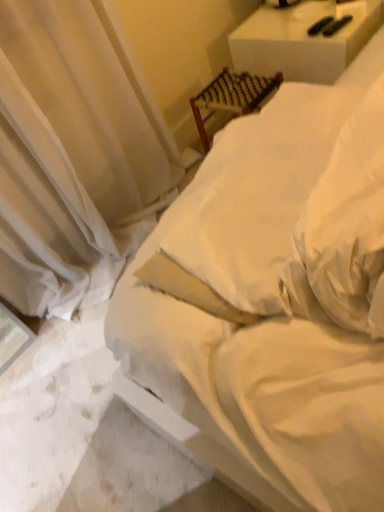
Measure the distance between point (268, 84) and camera.

The depth of point (268, 84) is 6.30 feet.

The width and height of the screenshot is (384, 512). What do you see at coordinates (303, 40) in the screenshot?
I see `white woven chair at upper right, the 2th furniture from the left` at bounding box center [303, 40].

The height and width of the screenshot is (512, 384). Find the location of `white sheer curtain at upper left`. white sheer curtain at upper left is located at coordinates (70, 158).

Is point (293, 17) positioned before point (51, 95)?

No.

From the image's perspective, is white woven chair at upper right, the 2th furniture from the left, above or below white sheer curtain at upper left?

white woven chair at upper right, the 2th furniture from the left, is above white sheer curtain at upper left.

Is white woven chair at upper right, the 2th furniture from the left, to the right of white sheer curtain at upper left from the viewer's perspective?

Yes.

Is white woven chair at upper right, the 2th furniture from the left, looking in the opposite direction of white sheer curtain at upper left?

white woven chair at upper right, the 2th furniture from the left, does not have its back to white sheer curtain at upper left.

Does white soft bed at center have a lesser height compared to white sheer curtain at upper left?

Yes.

Can white sheer curtain at upper left be found inside white soft bed at center?

No, white sheer curtain at upper left is not surrounded by white soft bed at center.

Can you tell me how much white soft bed at center and white sheer curtain at upper left differ in facing direction?

The angle between the facing direction of white soft bed at center and the facing direction of white sheer curtain at upper left is 89.5 degrees.

Is white soft bed at center looking in the opposite direction of white sheer curtain at upper left?

That's not correct — white soft bed at center is not looking away from white sheer curtain at upper left.

Does white soft bed at center have a smaller size compared to woven wood chair at upper center, which ranks as the first furniture in left-to-right order?

Incorrect, white soft bed at center is not smaller in size than woven wood chair at upper center, which ranks as the first furniture in left-to-right order.

This screenshot has width=384, height=512. There is a white soft bed at center. What are the coordinates of `the 2nd furniture below it (from a real-world perspective)` in the screenshot? It's located at (231, 97).

Can you tell me how much white soft bed at center and woven wood chair at upper center, marked as the second furniture in a right-to-left arrangement, differ in facing direction?

1.64 degrees separate the facing orientations of white soft bed at center and woven wood chair at upper center, marked as the second furniture in a right-to-left arrangement.

Is white soft bed at center far from woven wood chair at upper center, which ranks as the first furniture in left-to-right order?

No, there isn't a large distance between white soft bed at center and woven wood chair at upper center, which ranks as the first furniture in left-to-right order.

Which object is positioned more to the right, woven wood chair at upper center, marked as the second furniture in a right-to-left arrangement, or white sheer curtain at upper left?

From the viewer's perspective, woven wood chair at upper center, marked as the second furniture in a right-to-left arrangement, appears more on the right side.

Considering the sizes of woven wood chair at upper center, marked as the second furniture in a right-to-left arrangement, and white sheer curtain at upper left in the image, is woven wood chair at upper center, marked as the second furniture in a right-to-left arrangement, bigger or smaller than white sheer curtain at upper left?

In the image, woven wood chair at upper center, marked as the second furniture in a right-to-left arrangement, appears to be smaller than white sheer curtain at upper left.

You are a GUI agent. You are given a task and a screenshot of the screen. Output one action in this format:
    pyautogui.click(x=<x>, y=<y>)
    Task: Click on the curtain on the left of woven wood chair at upper center, marked as the second furniture in a right-to-left arrangement
    
    Given the screenshot: What is the action you would take?
    pyautogui.click(x=70, y=158)

From the image's perspective, is woven wood chair at upper center, marked as the second furniture in a right-to-left arrangement, above or below white sheer curtain at upper left?

woven wood chair at upper center, marked as the second furniture in a right-to-left arrangement, is above white sheer curtain at upper left.

Is woven wood chair at upper center, marked as the second furniture in a right-to-left arrangement, surrounding white soft bed at center?

Actually, white soft bed at center is outside woven wood chair at upper center, marked as the second furniture in a right-to-left arrangement.

Could you tell me if woven wood chair at upper center, marked as the second furniture in a right-to-left arrangement, is turned towards white soft bed at center?

No, woven wood chair at upper center, marked as the second furniture in a right-to-left arrangement, is not facing towards white soft bed at center.

Is woven wood chair at upper center, which ranks as the first furniture in left-to-right order, taller or shorter than white soft bed at center?

woven wood chair at upper center, which ranks as the first furniture in left-to-right order, is shorter than white soft bed at center.

Which object is thinner, woven wood chair at upper center, marked as the second furniture in a right-to-left arrangement, or white soft bed at center?

woven wood chair at upper center, marked as the second furniture in a right-to-left arrangement.

Would you say white sheer curtain at upper left is inside or outside white woven chair at upper right, the 2th furniture from the left?

white sheer curtain at upper left exists outside the volume of white woven chair at upper right, the 2th furniture from the left.

From a real-world perspective, is white sheer curtain at upper left above or below white woven chair at upper right, the first furniture when ordered from right to left?

Clearly, from a real-world perspective, white sheer curtain at upper left is above white woven chair at upper right, the first furniture when ordered from right to left.

Looking at this image, between white sheer curtain at upper left and white woven chair at upper right, the 2th furniture from the left, which one has smaller width?

Thinner between the two is white sheer curtain at upper left.

Considering the relative positions of white sheer curtain at upper left and white woven chair at upper right, the 2th furniture from the left, in the image provided, is white sheer curtain at upper left behind white woven chair at upper right, the 2th furniture from the left,?

No, it is not.

Which of these two, white woven chair at upper right, the 2th furniture from the left, or woven wood chair at upper center, which ranks as the first furniture in left-to-right order, is wider?

Wider between the two is white woven chair at upper right, the 2th furniture from the left.

Considering the positions of objects white woven chair at upper right, the first furniture when ordered from right to left, and woven wood chair at upper center, marked as the second furniture in a right-to-left arrangement, in the image provided, who is in front, white woven chair at upper right, the first furniture when ordered from right to left, or woven wood chair at upper center, marked as the second furniture in a right-to-left arrangement,?

white woven chair at upper right, the first furniture when ordered from right to left, is closer to the camera.

Is white woven chair at upper right, the first furniture when ordered from right to left, shorter than woven wood chair at upper center, marked as the second furniture in a right-to-left arrangement?

In fact, white woven chair at upper right, the first furniture when ordered from right to left, may be taller than woven wood chair at upper center, marked as the second furniture in a right-to-left arrangement.

From a real-world perspective, is white woven chair at upper right, the first furniture when ordered from right to left, physically located above or below woven wood chair at upper center, marked as the second furniture in a right-to-left arrangement?

In terms of real-world spatial position, white woven chair at upper right, the first furniture when ordered from right to left, is above woven wood chair at upper center, marked as the second furniture in a right-to-left arrangement.

Which furniture is the 1st one when counting from the back of the white sheer curtain at upper left? Please provide its 2D coordinates.

[(303, 40)]

Locate an element on the screen. bed below the white sheer curtain at upper left (from the image's perspective) is located at coordinates (278, 298).

Considering their positions, is white woven chair at upper right, the first furniture when ordered from right to left, positioned further to white soft bed at center than white sheer curtain at upper left?

white woven chair at upper right, the first furniture when ordered from right to left, is further to white soft bed at center.

When comparing their distances from white woven chair at upper right, the first furniture when ordered from right to left, does white sheer curtain at upper left or woven wood chair at upper center, which ranks as the first furniture in left-to-right order, seem closer?

The object closer to white woven chair at upper right, the first furniture when ordered from right to left, is woven wood chair at upper center, which ranks as the first furniture in left-to-right order.

Considering their positions, is white woven chair at upper right, the first furniture when ordered from right to left, positioned closer to white sheer curtain at upper left than woven wood chair at upper center, which ranks as the first furniture in left-to-right order?

Among the two, woven wood chair at upper center, which ranks as the first furniture in left-to-right order, is located nearer to white sheer curtain at upper left.

From the image, which object appears to be nearer to woven wood chair at upper center, marked as the second furniture in a right-to-left arrangement, white woven chair at upper right, the first furniture when ordered from right to left, or white sheer curtain at upper left?

Among the two, white woven chair at upper right, the first furniture when ordered from right to left, is located nearer to woven wood chair at upper center, marked as the second furniture in a right-to-left arrangement.

Considering their positions, is white sheer curtain at upper left positioned further to white soft bed at center than woven wood chair at upper center, which ranks as the first furniture in left-to-right order?

Among the two, woven wood chair at upper center, which ranks as the first furniture in left-to-right order, is located further to white soft bed at center.

Based on their spatial positions, is white woven chair at upper right, the 2th furniture from the left, or woven wood chair at upper center, marked as the second furniture in a right-to-left arrangement, further from white soft bed at center?

white woven chair at upper right, the 2th furniture from the left.

Which object lies further to the anchor point woven wood chair at upper center, marked as the second furniture in a right-to-left arrangement, white woven chair at upper right, the 2th furniture from the left, or white soft bed at center?

Among the two, white soft bed at center is located further to woven wood chair at upper center, marked as the second furniture in a right-to-left arrangement.

From the image, which object appears to be nearer to white sheer curtain at upper left, white soft bed at center or woven wood chair at upper center, which ranks as the first furniture in left-to-right order?

Based on the image, woven wood chair at upper center, which ranks as the first furniture in left-to-right order, appears to be nearer to white sheer curtain at upper left.

Where is `furniture located between white soft bed at center and woven wood chair at upper center, which ranks as the first furniture in left-to-right order, in the depth direction`? furniture located between white soft bed at center and woven wood chair at upper center, which ranks as the first furniture in left-to-right order, in the depth direction is located at coordinates (303, 40).

Find the location of `furniture between white sheer curtain at upper left and white woven chair at upper right, the 2th furniture from the left, from left to right`. furniture between white sheer curtain at upper left and white woven chair at upper right, the 2th furniture from the left, from left to right is located at coordinates 231,97.

Identify the location of curtain positioned between white soft bed at center and white woven chair at upper right, the first furniture when ordered from right to left, from near to far. (70, 158).

Find the location of `curtain located between white soft bed at center and woven wood chair at upper center, marked as the second furniture in a right-to-left arrangement, in the depth direction`. curtain located between white soft bed at center and woven wood chair at upper center, marked as the second furniture in a right-to-left arrangement, in the depth direction is located at coordinates (70, 158).